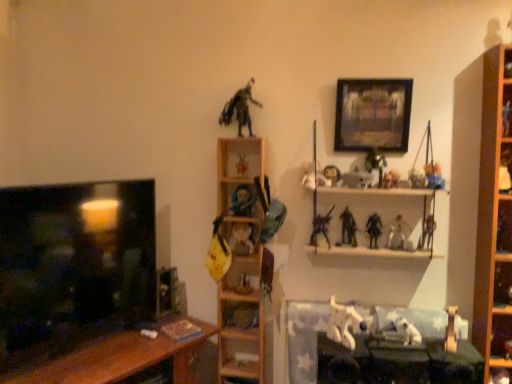
Question: In which direction should I rotate to look at shiny black figure at upper center, which is the ninth toy in left-to-right order?

Choices:
 (A) right
 (B) left

Answer: (A)

Question: From the image's perspective, is metallic silver action figure at upper center, acting as the 7th toy starting from the right, below wooden shelf at upper center, positioned as the third shelf in left-to-right order?

Choices:
 (A) no
 (B) yes

Answer: (A)

Question: Is metallic silver action figure at upper center, acting as the 7th toy starting from the right, positioned beyond the bounds of wooden shelf at upper center, which ranks as the 2th shelf in right-to-left order?

Choices:
 (A) no
 (B) yes

Answer: (A)

Question: Is metallic silver action figure at upper center, acting as the 7th toy starting from the right, closer to the viewer compared to wooden shelf at upper center, which ranks as the 2th shelf in right-to-left order?

Choices:
 (A) no
 (B) yes

Answer: (A)

Question: Is metallic silver action figure at upper center, acting as the 7th toy starting from the right, wider than wooden shelf at upper center, which ranks as the 2th shelf in right-to-left order?

Choices:
 (A) yes
 (B) no

Answer: (B)

Question: From a real-world perspective, is metallic silver action figure at upper center, acting as the 7th toy starting from the right, located higher than wooden shelf at upper center, positioned as the third shelf in left-to-right order?

Choices:
 (A) yes
 (B) no

Answer: (A)

Question: Is metallic silver action figure at upper center, arranged as the eleventh toy when viewed from the left, oriented towards wooden shelf at upper center, positioned as the third shelf in left-to-right order?

Choices:
 (A) no
 (B) yes

Answer: (B)

Question: Would you consider metallic silver action figure at upper center, arranged as the eleventh toy when viewed from the left, to be distant from wooden shelf at center, which is the 3th shelf from right to left?

Choices:
 (A) yes
 (B) no

Answer: (B)

Question: Considering the relative sizes of metallic silver action figure at upper center, acting as the 7th toy starting from the right, and wooden shelf at center, which is the 3th shelf from right to left, in the image provided, is metallic silver action figure at upper center, acting as the 7th toy starting from the right, bigger than wooden shelf at center, which is the 3th shelf from right to left,?

Choices:
 (A) no
 (B) yes

Answer: (A)

Question: Considering the relative sizes of metallic silver action figure at upper center, arranged as the eleventh toy when viewed from the left, and wooden shelf at center, which appears as the 2th shelf when viewed from the left, in the image provided, is metallic silver action figure at upper center, arranged as the eleventh toy when viewed from the left, wider than wooden shelf at center, which appears as the 2th shelf when viewed from the left,?

Choices:
 (A) yes
 (B) no

Answer: (B)

Question: Is metallic silver action figure at upper center, arranged as the eleventh toy when viewed from the left, outside of wooden shelf at center, which appears as the 2th shelf when viewed from the left?

Choices:
 (A) no
 (B) yes

Answer: (B)

Question: From the image's perspective, does metallic silver action figure at upper center, arranged as the eleventh toy when viewed from the left, appear lower than wooden shelf at center, which appears as the 2th shelf when viewed from the left?

Choices:
 (A) yes
 (B) no

Answer: (B)

Question: Is metallic silver action figure at upper center, arranged as the eleventh toy when viewed from the left, behind wooden shelf at center, which is the 3th shelf from right to left?

Choices:
 (A) no
 (B) yes

Answer: (B)

Question: Are metallic silver sword at center, which is the 5th toy from right to left, and wooden shelf at center, arranged as the 1th shelf when viewed from the left, far apart?

Choices:
 (A) no
 (B) yes

Answer: (A)